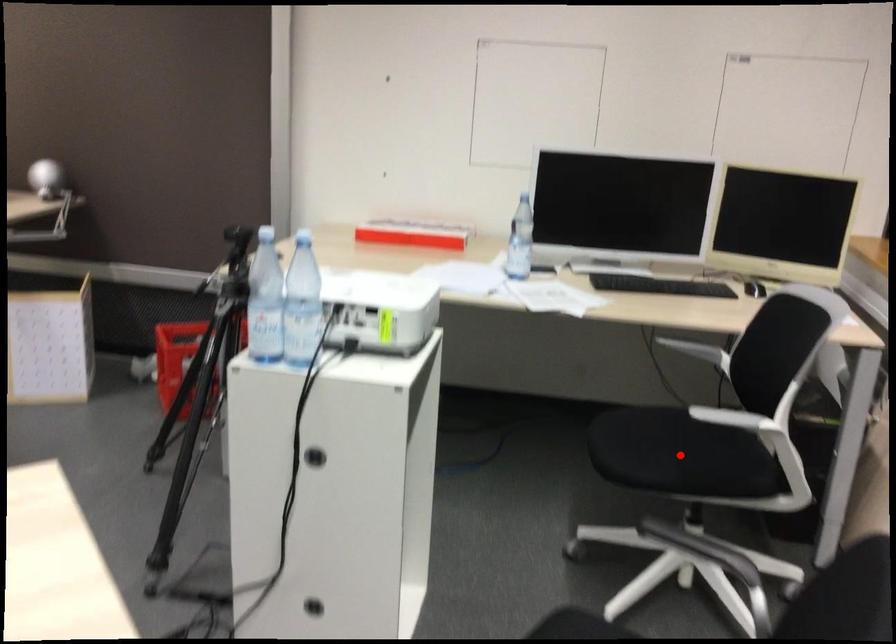
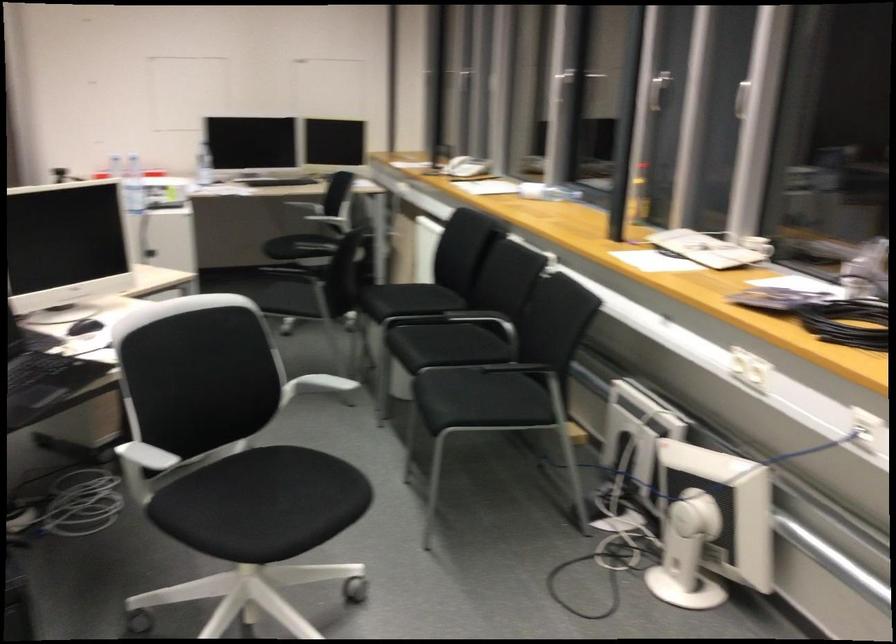
Question: A red point is marked in image1. In image2, is the corresponding 3D point closer to the camera or farther? Reply with the corresponding letter.

Choices:
 (A) The corresponding 3D point is closer.
 (B) The corresponding 3D point is farther.

Answer: (B)